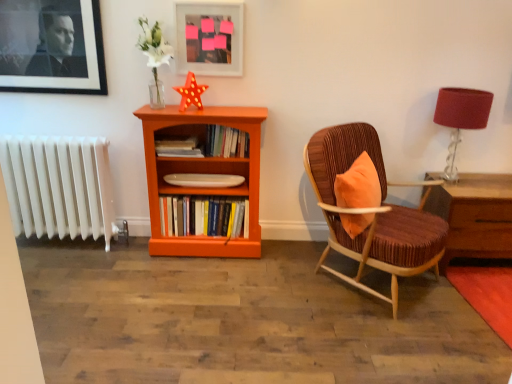
Image resolution: width=512 pixels, height=384 pixels. I want to click on free point above black matte picture frame at upper left, which is the 2th picture frame from right to left (from a real-world perspective), so click(x=44, y=0).